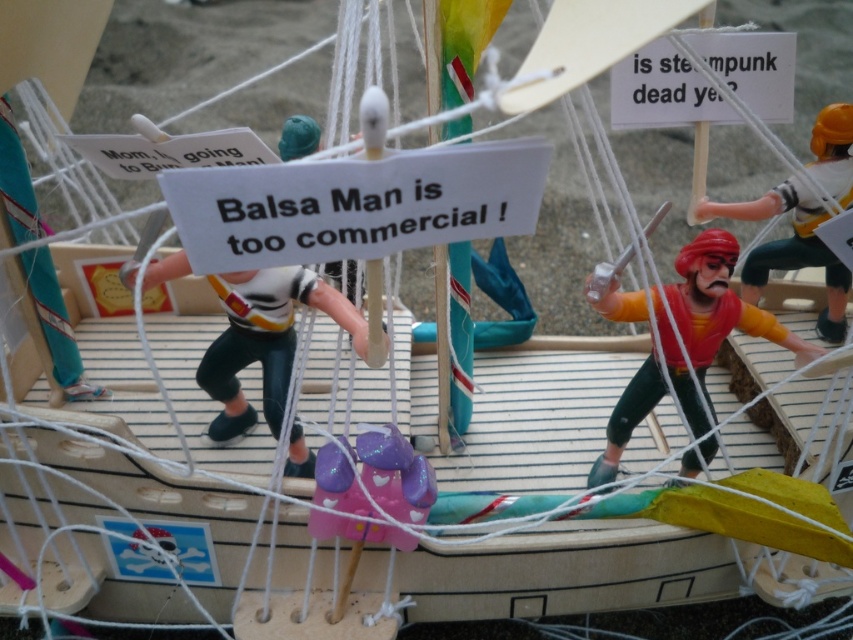
Is point (218, 227) positioned before point (757, 285)?

That is True.

Is point (320, 189) positioned after point (824, 269)?

No, (320, 189) is in front of (824, 269).

The image size is (853, 640). Identify the location of white paper sign at center. (355, 204).

Which is more to the left, white plastic figure at center or purple glittery toy at center?

white plastic figure at center

Between white plastic figure at center and purple glittery toy at center, which one is positioned higher?

white plastic figure at center is higher up.

Locate an element on the screen. The height and width of the screenshot is (640, 853). white plastic figure at center is located at coordinates (265, 340).

Which is behind, point (460, 216) or point (384, 490)?

The point (384, 490) is more distant.

Is white paper sign at center above purple glittery toy at center?

Correct, white paper sign at center is located above purple glittery toy at center.

Find the location of a particular element. The width and height of the screenshot is (853, 640). white paper sign at center is located at coordinates (355, 204).

Find the location of `white paper sign at center`. white paper sign at center is located at coordinates (355, 204).